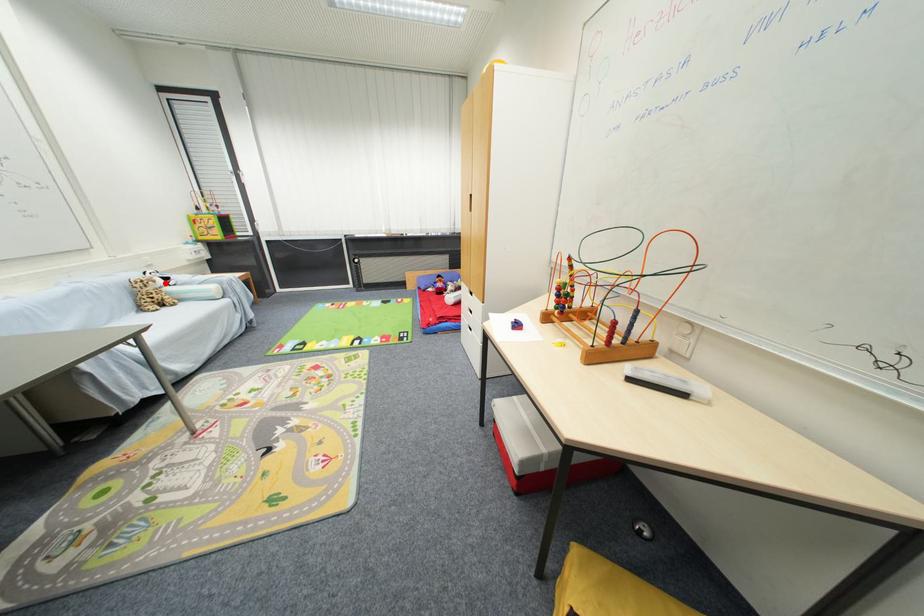
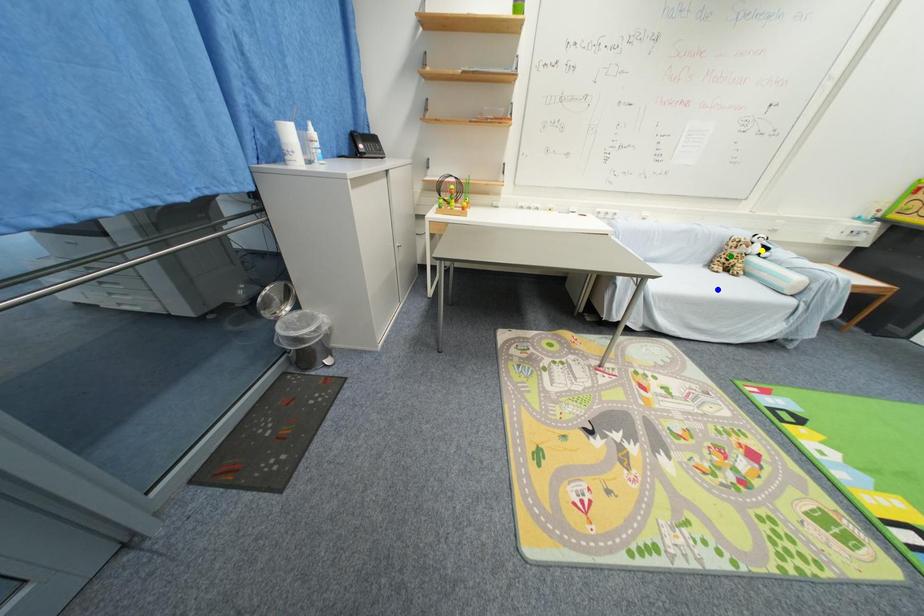
Question: I am providing you with two images of the same scene from different viewpoints. A red point is marked on the first image. You are given multiple points on the second image. In image 2, which mark is for the same physical point as the one in image 1?

Choices:
 (A) blue point
 (B) green point
 (C) yellow point

Answer: (C)